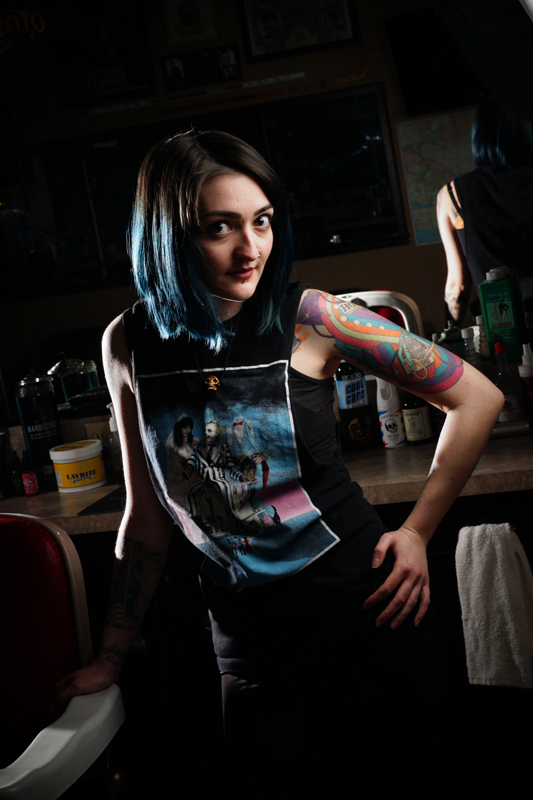
This screenshot has width=533, height=800. I want to click on light brown bar, so click(489, 474).